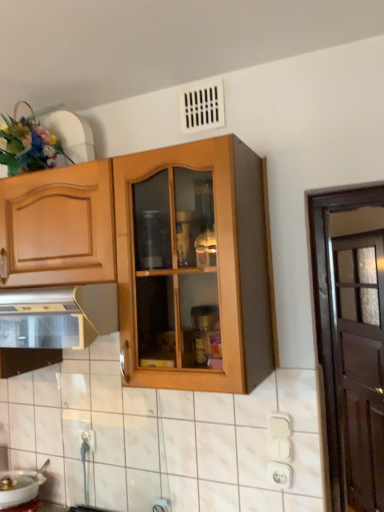
Question: Is metallic stainless steel oven at lower left thinner than fluffy floral bouquet at upper left?

Choices:
 (A) yes
 (B) no

Answer: (B)

Question: Is metallic stainless steel oven at lower left facing away from fluffy floral bouquet at upper left?

Choices:
 (A) no
 (B) yes

Answer: (A)

Question: Considering the relative sizes of metallic stainless steel oven at lower left and fluffy floral bouquet at upper left in the image provided, is metallic stainless steel oven at lower left smaller than fluffy floral bouquet at upper left?

Choices:
 (A) no
 (B) yes

Answer: (A)

Question: Would you consider metallic stainless steel oven at lower left to be distant from fluffy floral bouquet at upper left?

Choices:
 (A) no
 (B) yes

Answer: (A)

Question: Is metallic stainless steel oven at lower left touching fluffy floral bouquet at upper left?

Choices:
 (A) yes
 (B) no

Answer: (B)

Question: Does metallic stainless steel oven at lower left appear on the right side of fluffy floral bouquet at upper left?

Choices:
 (A) yes
 (B) no

Answer: (A)

Question: Does white plastic electric outlet at lower center, the second electric outlet when ordered from front to back, have a lesser height compared to white glossy sink at lower left?

Choices:
 (A) yes
 (B) no

Answer: (B)

Question: Is white plastic electric outlet at lower center, the first electric outlet from the back, facing towards white glossy sink at lower left?

Choices:
 (A) no
 (B) yes

Answer: (A)

Question: Does white plastic electric outlet at lower center, the first electric outlet in the left-to-right sequence, have a larger size compared to white glossy sink at lower left?

Choices:
 (A) no
 (B) yes

Answer: (A)

Question: Is the depth of white plastic electric outlet at lower center, the first electric outlet in the left-to-right sequence, greater than that of white glossy sink at lower left?

Choices:
 (A) yes
 (B) no

Answer: (A)

Question: Considering the relative positions of white plastic electric outlet at lower center, the first electric outlet in the left-to-right sequence, and white glossy sink at lower left in the image provided, is white plastic electric outlet at lower center, the first electric outlet in the left-to-right sequence, in front of white glossy sink at lower left?

Choices:
 (A) no
 (B) yes

Answer: (A)

Question: Is white glossy sink at lower left surrounded by white plastic electric outlet at lower center, the second electric outlet when ordered from front to back?

Choices:
 (A) no
 (B) yes

Answer: (A)

Question: Does metallic stainless steel oven at lower left have a lesser height compared to white glossy sink at lower left?

Choices:
 (A) no
 (B) yes

Answer: (A)